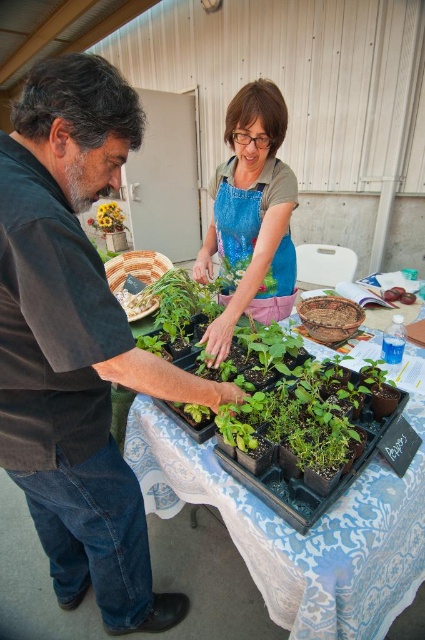
Question: Observing the image, what is the correct spatial positioning of blue fabric apron at center in reference to yellow matte flower at upper left?

Choices:
 (A) above
 (B) below

Answer: (B)

Question: Which of the following is the farthest from the observer?

Choices:
 (A) blue fabric apron at center
 (B) green plastic tray at center
 (C) yellow matte flower at upper left
 (D) matte black shirt at left

Answer: (C)

Question: Based on their relative distances, which object is nearer to the green plastic tray at center?

Choices:
 (A) blue fabric apron at center
 (B) matte black shirt at left

Answer: (B)

Question: Does green plastic tray at center lie in front of yellow matte flower at upper left?

Choices:
 (A) no
 (B) yes

Answer: (B)

Question: Which object appears closest to the camera in this image?

Choices:
 (A) blue fabric apron at center
 (B) green plastic tray at center
 (C) matte black shirt at left

Answer: (C)

Question: Does green plastic tray at center have a lesser width compared to blue fabric apron at center?

Choices:
 (A) no
 (B) yes

Answer: (A)